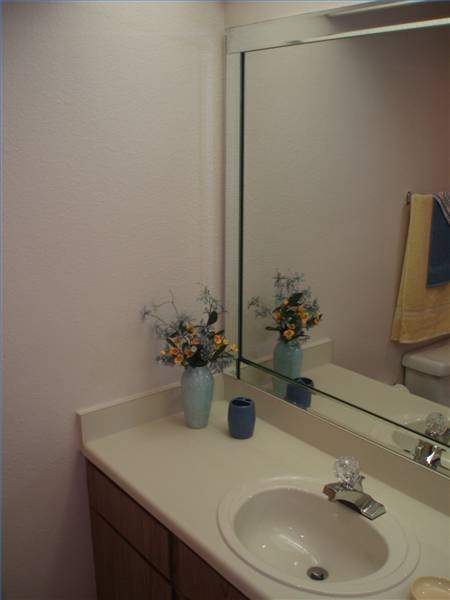
Image resolution: width=450 pixels, height=600 pixels. I want to click on sink, so click(x=289, y=522).